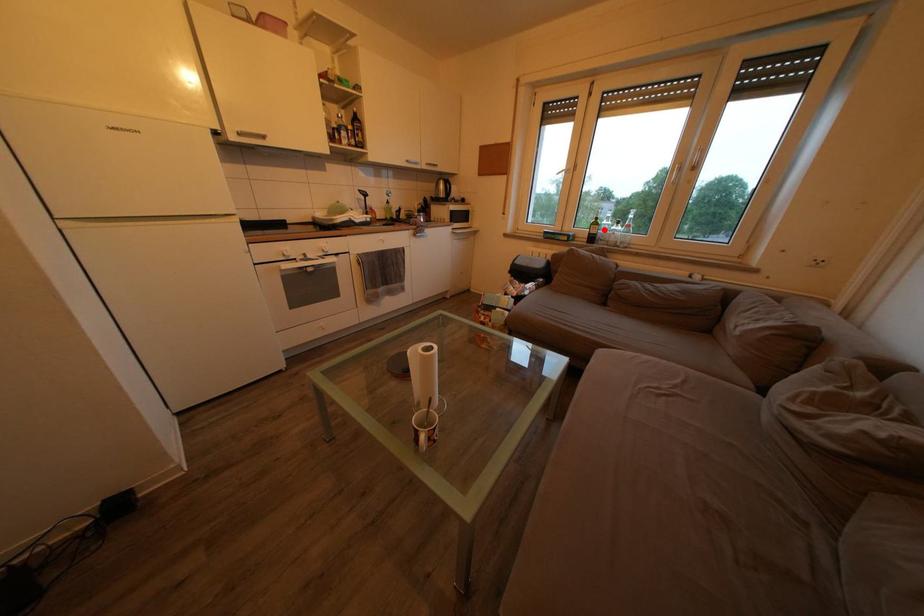
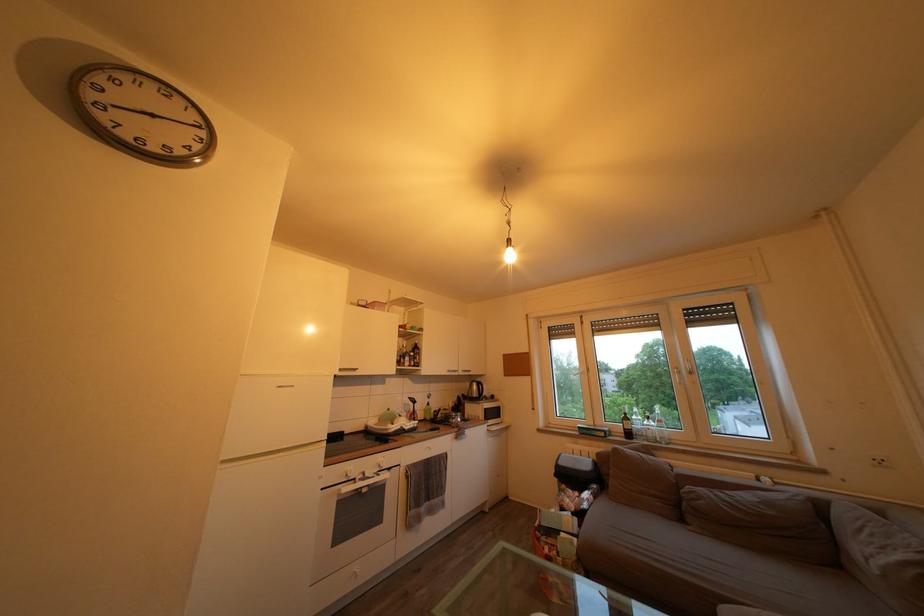
Find the pixel in the second image that matches the highlighted location in the first image.

(635, 424)